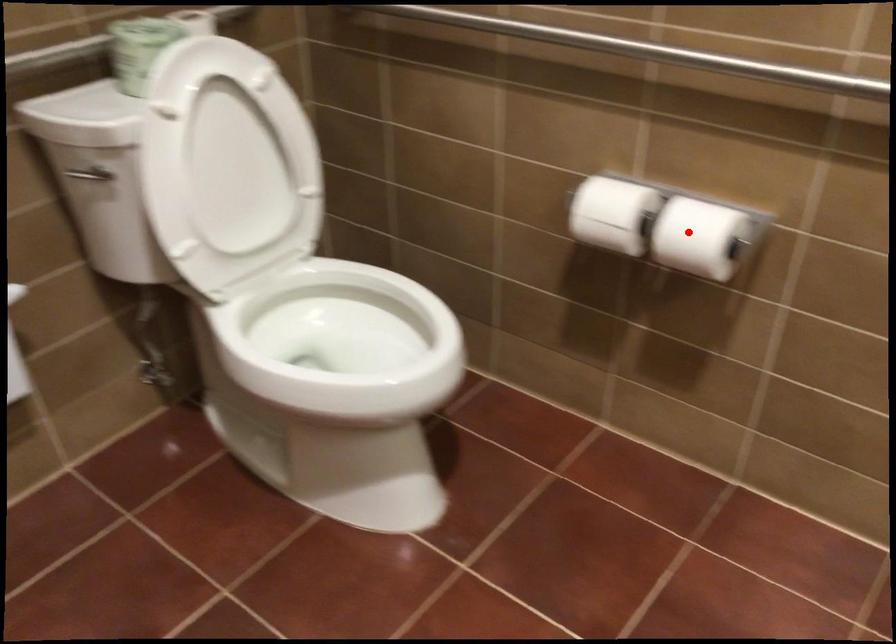
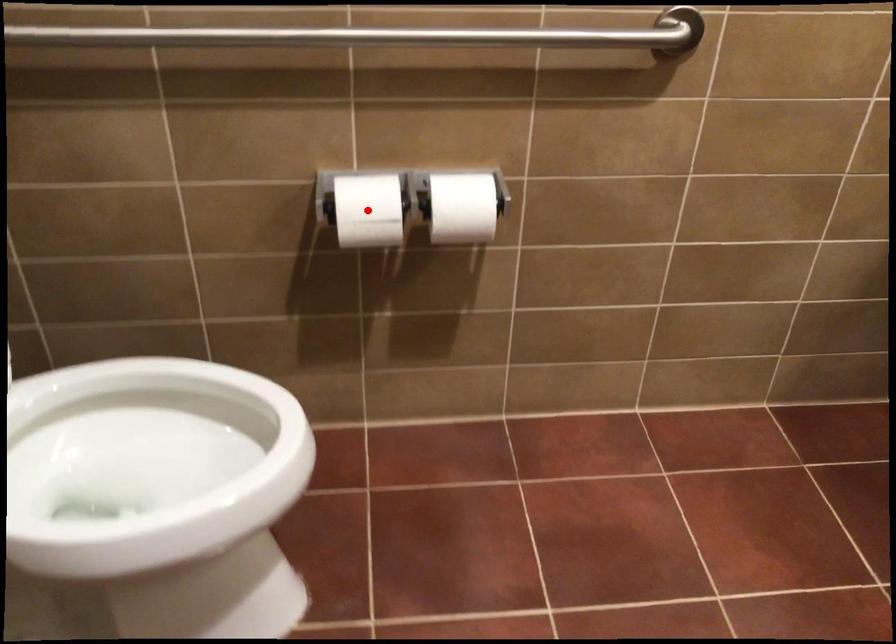
I am providing you with two images of the same scene from different viewpoints. A red point is marked on the first image and another point is marked on the second image. Does the point marked in image1 correspond to the same location as the one in image2?

No